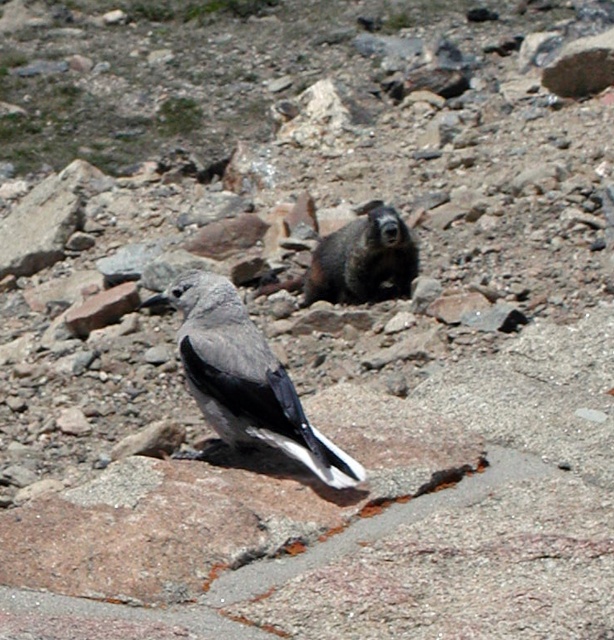
Does gray matte bird at center appear on the right side of brown furry rock at center?

In fact, gray matte bird at center is to the left of brown furry rock at center.

Does gray matte bird at center have a larger size compared to brown furry rock at center?

Yes.

Who is more forward, (217, 381) or (356, 230)?

Positioned in front is point (217, 381).

I want to click on gray matte bird at center, so click(x=246, y=378).